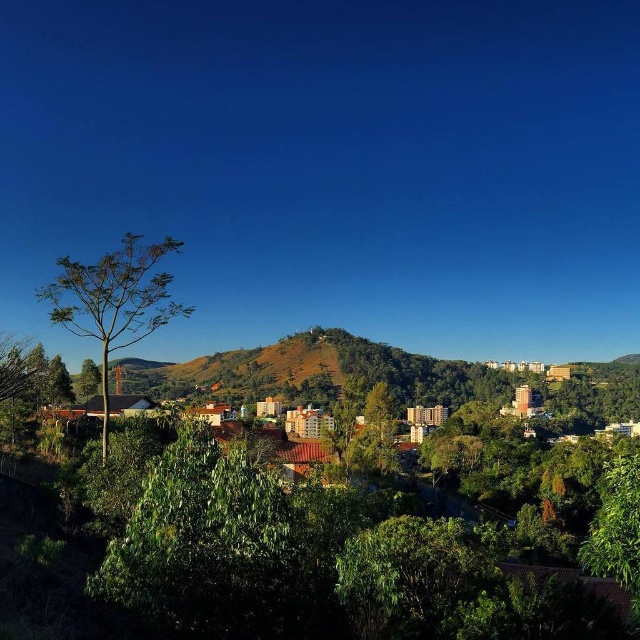
Can you confirm if green glossy tree at center is taller than green leafy tree at left?

No, green glossy tree at center is not taller than green leafy tree at left.

Who is positioned more to the right, green glossy tree at center or green leafy tree at left?

Positioned to the right is green glossy tree at center.

This screenshot has width=640, height=640. Find the location of `green glossy tree at center`. green glossy tree at center is located at coordinates (209, 547).

Can you confirm if green glossy tree at center is wider than green leafy tree at lower right?

Incorrect, green glossy tree at center's width does not surpass green leafy tree at lower right's.

How far apart are green glossy tree at center and green leafy tree at lower right?

The distance of green glossy tree at center from green leafy tree at lower right is 81.95 feet.

Does point (285, 550) lie in front of point (600, 564)?

No.

What are the coordinates of `green glossy tree at center` in the screenshot? It's located at (209, 547).

Between point (84, 332) and point (586, 563), which one is positioned behind?

The point (84, 332) is behind.

Does green leafy tree at left have a greater height compared to green leafy tree at lower right?

Incorrect, green leafy tree at left's height is not larger of green leafy tree at lower right's.

Locate an element on the screen. green leafy tree at left is located at coordinates (115, 301).